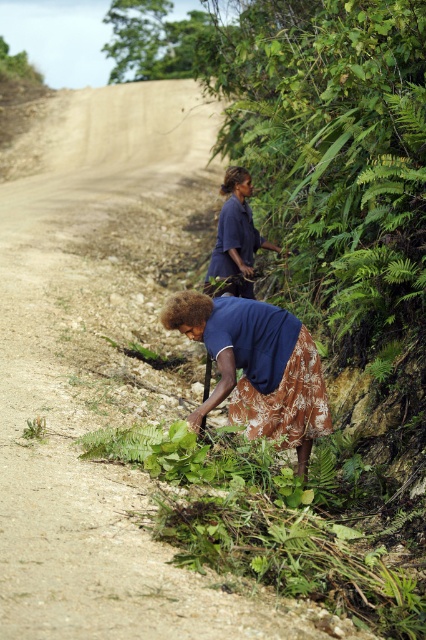
Question: Which point is farther to the camera?

Choices:
 (A) (236, 186)
 (B) (195, 419)

Answer: (A)

Question: Can you confirm if brown floral skirt at lower center is positioned to the right of dark blue fabric at center?

Choices:
 (A) yes
 (B) no

Answer: (A)

Question: Can you confirm if brown floral skirt at lower center is positioned below dark blue fabric at center?

Choices:
 (A) yes
 (B) no

Answer: (A)

Question: Is brown floral skirt at lower center wider than dark blue fabric at center?

Choices:
 (A) yes
 (B) no

Answer: (A)